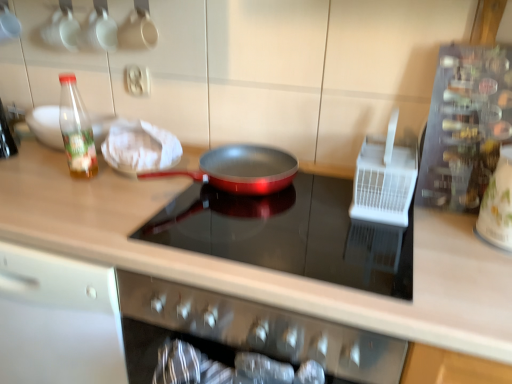
The height and width of the screenshot is (384, 512). I want to click on vacant space in between metallic silver spice rack at right, placed as the second appliance when sorted from left to right, and white plastic utensil holder at right, which is the 1th appliance from left to right, so click(442, 220).